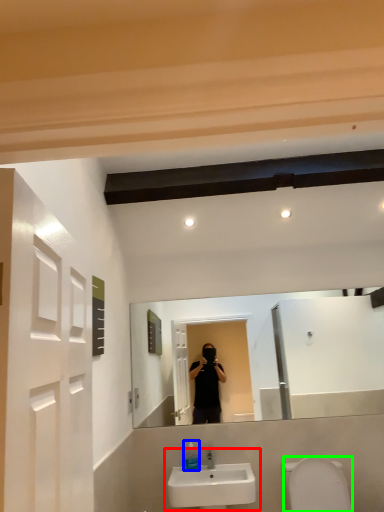
Question: Which object is the farthest from sink (highlighted by a red box)? Choose among these: soap dispenser (highlighted by a blue box) or toilet bowl (highlighted by a green box).

Choices:
 (A) soap dispenser
 (B) toilet bowl

Answer: (B)